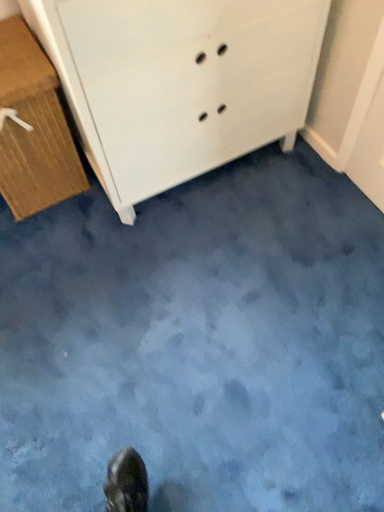
Question: Which direction should I rotate to face white matte chest of drawers at upper center, the first chest of drawers when ordered from right to left, — up or down?

Choices:
 (A) down
 (B) up

Answer: (B)

Question: Is wooden chest of drawers at left, which ranks as the 1th chest of drawers in left-to-right order, facing towards white matte chest of drawers at upper center, which is the 2th chest of drawers in left-to-right order?

Choices:
 (A) yes
 (B) no

Answer: (B)

Question: Is white matte chest of drawers at upper center, the first chest of drawers when ordered from right to left, inside wooden chest of drawers at left, which ranks as the 1th chest of drawers in left-to-right order?

Choices:
 (A) yes
 (B) no

Answer: (B)

Question: Does wooden chest of drawers at left, which is counted as the 2th chest of drawers, starting from the right, have a greater height compared to white matte chest of drawers at upper center, the first chest of drawers when ordered from right to left?

Choices:
 (A) yes
 (B) no

Answer: (B)

Question: Considering the relative sizes of wooden chest of drawers at left, which is counted as the 2th chest of drawers, starting from the right, and white matte chest of drawers at upper center, which is the 2th chest of drawers in left-to-right order, in the image provided, is wooden chest of drawers at left, which is counted as the 2th chest of drawers, starting from the right, shorter than white matte chest of drawers at upper center, which is the 2th chest of drawers in left-to-right order,?

Choices:
 (A) no
 (B) yes

Answer: (B)

Question: Is wooden chest of drawers at left, which ranks as the 1th chest of drawers in left-to-right order, oriented away from white matte chest of drawers at upper center, which is the 2th chest of drawers in left-to-right order?

Choices:
 (A) no
 (B) yes

Answer: (A)

Question: Is wooden chest of drawers at left, which ranks as the 1th chest of drawers in left-to-right order, to the right of white matte chest of drawers at upper center, the first chest of drawers when ordered from right to left, from the viewer's perspective?

Choices:
 (A) yes
 (B) no

Answer: (B)

Question: Can you confirm if white matte chest of drawers at upper center, which is the 2th chest of drawers in left-to-right order, is bigger than wooden chest of drawers at left, which is counted as the 2th chest of drawers, starting from the right?

Choices:
 (A) no
 (B) yes

Answer: (B)

Question: From the image's perspective, is white matte chest of drawers at upper center, which is the 2th chest of drawers in left-to-right order, located above wooden chest of drawers at left, which ranks as the 1th chest of drawers in left-to-right order?

Choices:
 (A) yes
 (B) no

Answer: (A)

Question: From the image's perspective, is white matte chest of drawers at upper center, which is the 2th chest of drawers in left-to-right order, located beneath wooden chest of drawers at left, which is counted as the 2th chest of drawers, starting from the right?

Choices:
 (A) yes
 (B) no

Answer: (B)

Question: From a real-world perspective, is white matte chest of drawers at upper center, which is the 2th chest of drawers in left-to-right order, on top of wooden chest of drawers at left, which is counted as the 2th chest of drawers, starting from the right?

Choices:
 (A) no
 (B) yes

Answer: (B)

Question: Considering the relative positions of white matte chest of drawers at upper center, the first chest of drawers when ordered from right to left, and wooden chest of drawers at left, which ranks as the 1th chest of drawers in left-to-right order, in the image provided, is white matte chest of drawers at upper center, the first chest of drawers when ordered from right to left, behind wooden chest of drawers at left, which ranks as the 1th chest of drawers in left-to-right order,?

Choices:
 (A) no
 (B) yes

Answer: (A)

Question: Is white matte chest of drawers at upper center, which is the 2th chest of drawers in left-to-right order, wider than wooden chest of drawers at left, which is counted as the 2th chest of drawers, starting from the right?

Choices:
 (A) no
 (B) yes

Answer: (B)

Question: From a real-world perspective, relative to white matte chest of drawers at upper center, which is the 2th chest of drawers in left-to-right order, is wooden chest of drawers at left, which ranks as the 1th chest of drawers in left-to-right order, vertically above or below?

Choices:
 (A) below
 (B) above

Answer: (A)